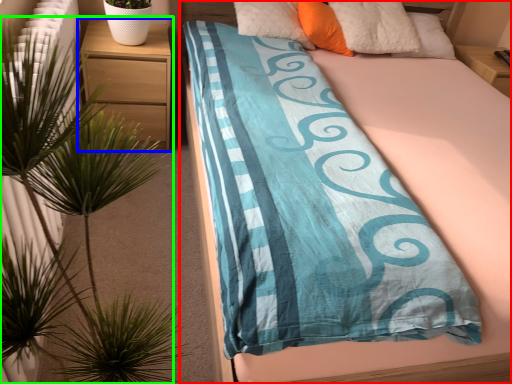
Question: Estimate the real-world distances between objects in this image. Which object is farther from bed (highlighted by a red box), nightstand (highlighted by a blue box) or houseplant (highlighted by a green box)?

Choices:
 (A) nightstand
 (B) houseplant

Answer: (B)